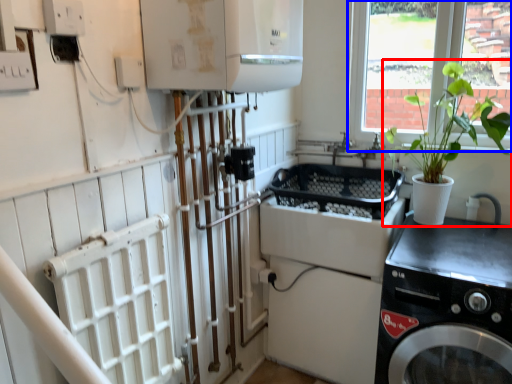
Question: Which object is closer to the camera taking this photo, houseplant (highlighted by a red box) or window (highlighted by a blue box)?

Choices:
 (A) houseplant
 (B) window

Answer: (A)